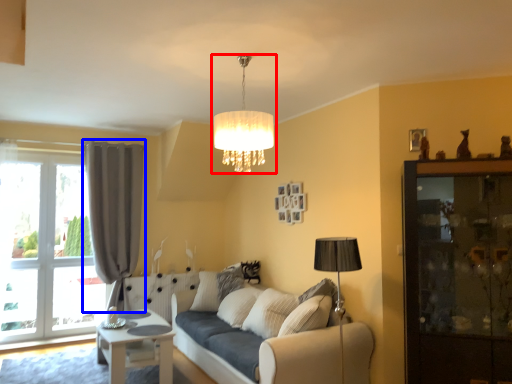
Question: Among these objects, which one is nearest to the camera, lamp (highlighted by a red box) or curtain (highlighted by a blue box)?

Choices:
 (A) lamp
 (B) curtain

Answer: (A)